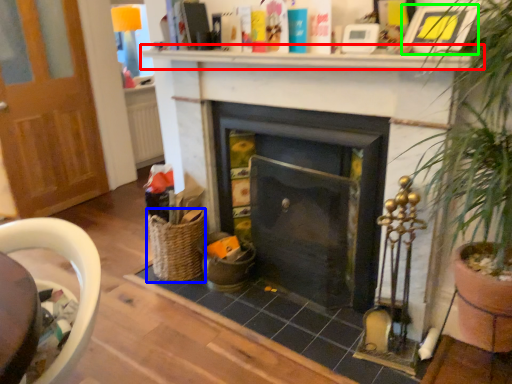
Question: Which object is the farthest from mantle (highlighted by a red box)? Choose among these: basket (highlighted by a blue box) or picture frame (highlighted by a green box).

Choices:
 (A) basket
 (B) picture frame

Answer: (A)